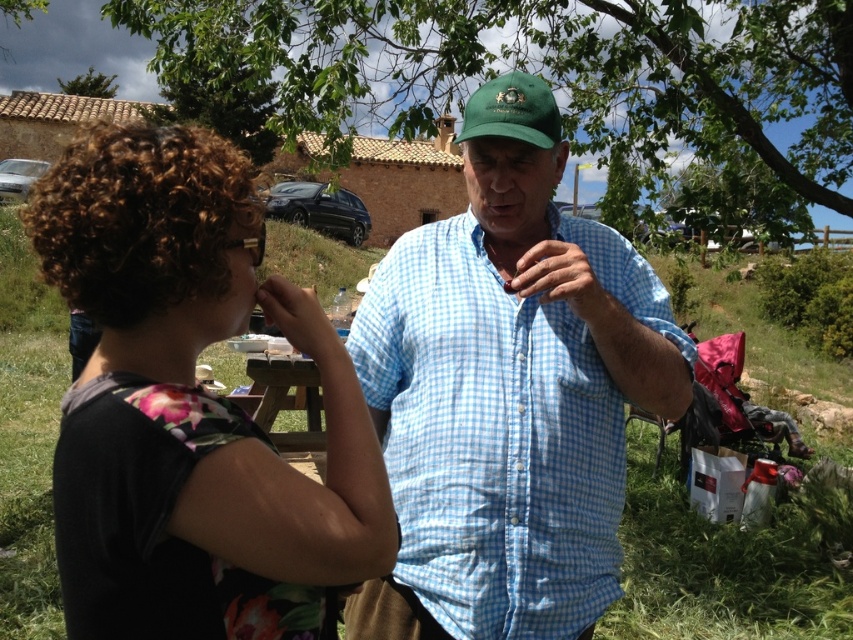
You are a photographer trying to capture a candid shot of the two people in the scene. To avoid casting a shadow on the subjects, you need to position yourself in a way that your shadow doesn not interfere. Given the current lighting and the positions of the green fabric baseball cap at center and the green leafy tree at upper left, where should you stand relative to the subjects?

The green fabric baseball cap at center is positioned under the green leafy tree at upper left, which means the tree is casting shade over the subjects. To avoid casting your shadow on them, you should position yourself between the subjects and the tree so that your shadow falls behind them rather than onto them.